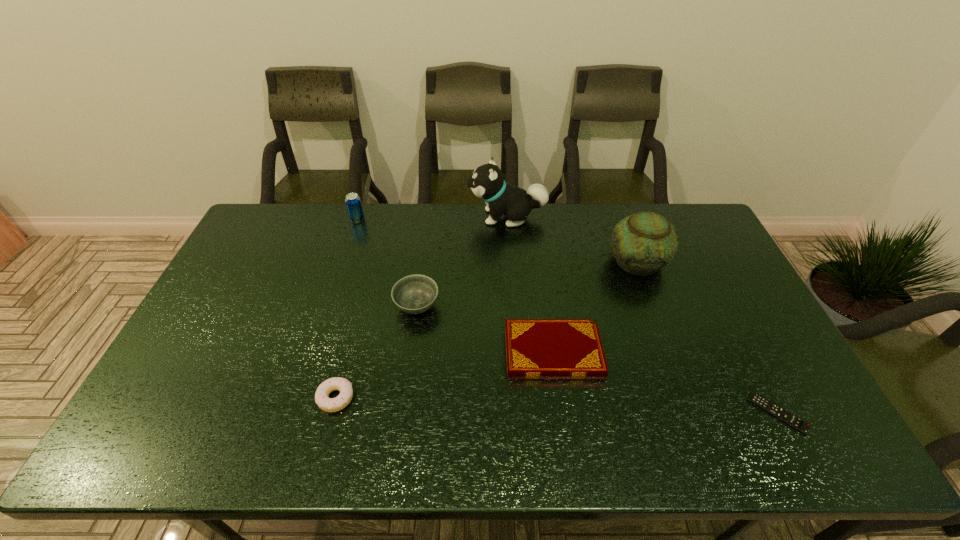
Where is `free point at the left edge`? The height and width of the screenshot is (540, 960). free point at the left edge is located at coordinates (196, 329).

In order to click on free space at the right edge of the desktop in this screenshot , I will do tap(726, 268).

I want to click on vacant space that is in between the tallest object and the sixth object from left to right, so click(x=572, y=239).

You are a GUI agent. You are given a task and a screenshot of the screen. Output one action in this format:
    pyautogui.click(x=<x>, y=<y>)
    Task: Click on the free space that is in between the leftmost object and the sixth object from right to left
    
    Given the screenshot: What is the action you would take?
    pyautogui.click(x=347, y=308)

At what (x,y) coordinates should I click in order to perform the action: click on vacant space in between the shortest object and the fifth shortest object. Please return your answer as a coordinate pair (x, y). Looking at the image, I should click on (567, 316).

Locate an element on the screen. The height and width of the screenshot is (540, 960). vacant space that's between the hardback book and the third tallest object is located at coordinates (455, 286).

Locate an element on the screen. The height and width of the screenshot is (540, 960). vacant space that's between the shortest object and the doughnut is located at coordinates (557, 406).

What are the coordinates of `free space that is in between the second object from left to right and the fourth shortest object` in the screenshot? It's located at (376, 352).

Locate an element on the screen. unoccupied position between the doughnut and the beer can is located at coordinates (347, 308).

Locate an element on the screen. free space between the beer can and the third object from left to right is located at coordinates (387, 262).